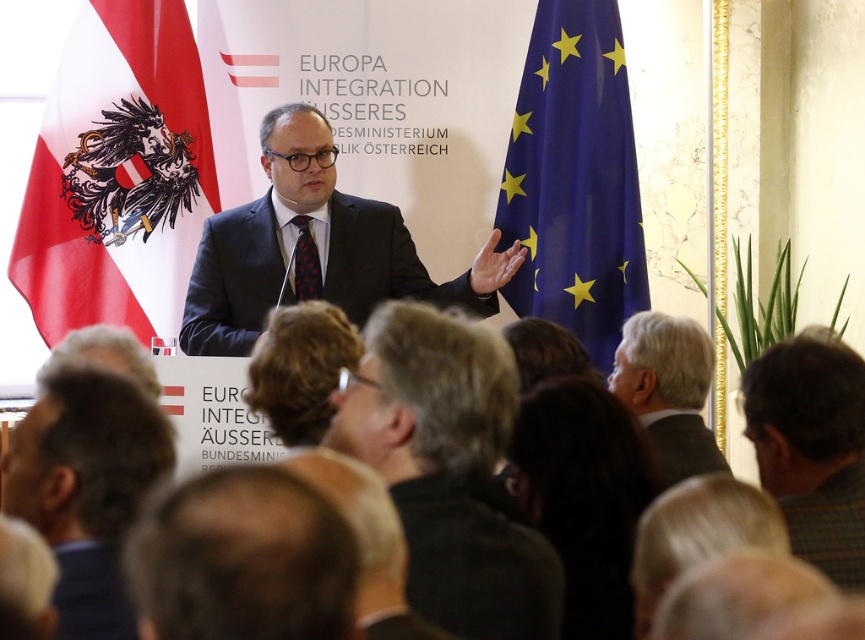
Question: Can you confirm if dark gray suit at center is bigger than matte black suit at center?

Choices:
 (A) yes
 (B) no

Answer: (B)

Question: Among these objects, which one is farthest from the camera?

Choices:
 (A) dark gray suit at center
 (B) green plaid suit at lower right
 (C) red and white fabric flag at left

Answer: (C)

Question: Which point appears closest to the camera in this image?

Choices:
 (A) (847, 436)
 (B) (63, 433)

Answer: (B)

Question: Which of these objects is positioned closest to the green plaid suit at lower right?

Choices:
 (A) red and white fabric flag at left
 (B) gray suit at lower right
 (C) matte black suit at center

Answer: (B)

Question: Where is red and white fabric flag at left located in relation to green plaid suit at lower right in the image?

Choices:
 (A) below
 (B) above

Answer: (B)

Question: Can you confirm if red and white fabric flag at left is positioned above blue fabric flag at right?

Choices:
 (A) no
 (B) yes

Answer: (B)